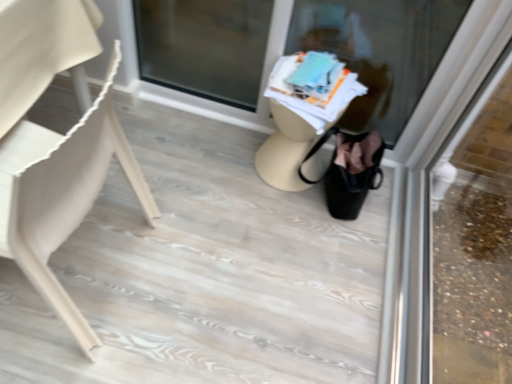
This screenshot has width=512, height=384. I want to click on free space between matte beige chair at left and translucent glass at center, the 2th shop window in the right-to-left sequence, so click(x=198, y=196).